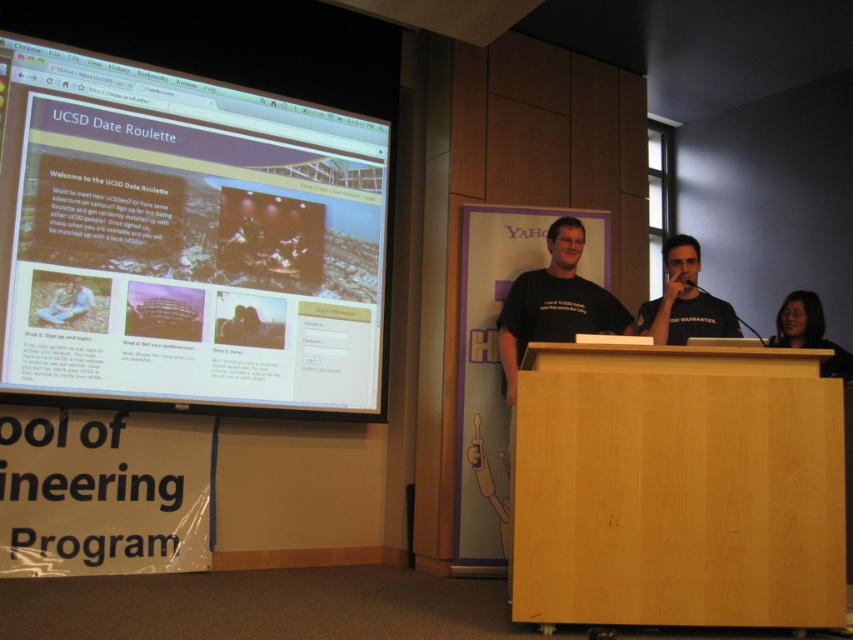
Does black matte t-shirt at center lie in front of matte black hair at lower right?

That is False.

This screenshot has width=853, height=640. What do you see at coordinates (554, 304) in the screenshot?
I see `black matte t-shirt at center` at bounding box center [554, 304].

The width and height of the screenshot is (853, 640). I want to click on black matte t-shirt at center, so click(x=554, y=304).

Is matte black screen at left bigger than light wood podium at center?

Yes.

Can you confirm if matte black screen at left is taller than light wood podium at center?

Yes.

Who is more forward, [77,355] or [697,536]?

Point [697,536]

You are a GUI agent. You are given a task and a screenshot of the screen. Output one action in this format:
    pyautogui.click(x=<x>, y=<y>)
    Task: Click on the matte black screen at left
    Image resolution: width=853 pixels, height=640 pixels.
    Given the screenshot: What is the action you would take?
    pyautogui.click(x=184, y=240)

Which is more to the left, black matte t-shirt at center or black matte shirt at center?

black matte t-shirt at center

What do you see at coordinates (554, 304) in the screenshot? The image size is (853, 640). I see `black matte t-shirt at center` at bounding box center [554, 304].

Locate an element on the screen. black matte t-shirt at center is located at coordinates (554, 304).